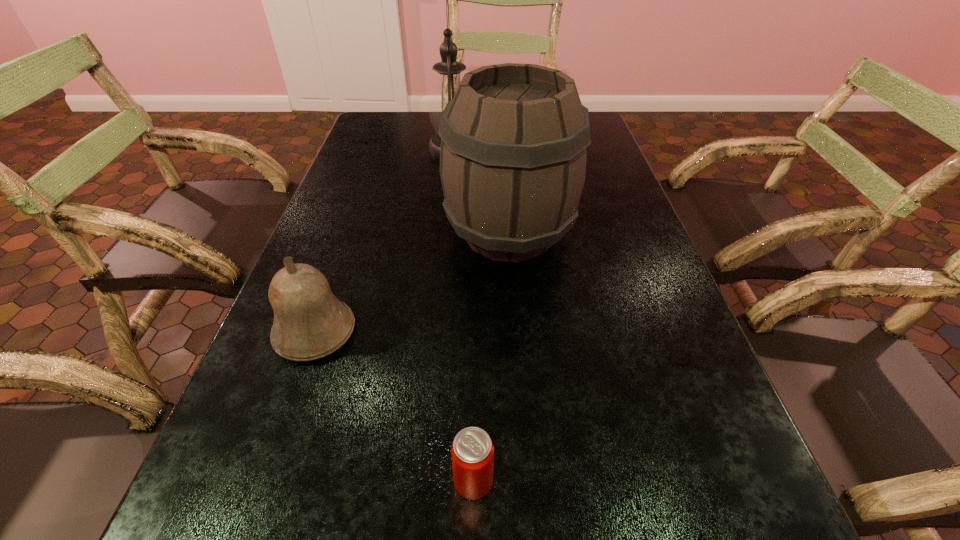
Identify the location of oil lamp. (449, 70).

Where is `the second tallest object`? The image size is (960, 540). the second tallest object is located at coordinates (513, 154).

At what (x,y) coordinates should I click in order to perform the action: click on wine bucket. Please return your answer as a coordinate pair (x, y). Looking at the image, I should click on (513, 154).

The height and width of the screenshot is (540, 960). Find the location of `the second nearest object`. the second nearest object is located at coordinates (x=309, y=323).

You are a GUI agent. You are given a task and a screenshot of the screen. Output one action in this format:
    pyautogui.click(x=<x>, y=<y>)
    Task: Click on the leftmost object
    The width and height of the screenshot is (960, 540).
    Given the screenshot: What is the action you would take?
    pyautogui.click(x=309, y=323)

Where is `the shortest object`? Image resolution: width=960 pixels, height=540 pixels. the shortest object is located at coordinates (472, 451).

You are a GUI agent. You are given a task and a screenshot of the screen. Output one action in this format:
    pyautogui.click(x=<x>, y=<y>)
    Task: Click on the nearest object
    This screenshot has width=960, height=540.
    Given the screenshot: What is the action you would take?
    pyautogui.click(x=472, y=451)

The width and height of the screenshot is (960, 540). In order to click on vacant area situated on the right of the oil lamp in this screenshot , I will do `click(582, 148)`.

Where is `free space located on the back of the second tallest object`? The width and height of the screenshot is (960, 540). free space located on the back of the second tallest object is located at coordinates (501, 133).

Locate an element on the screen. The height and width of the screenshot is (540, 960). free space located on the right of the bell is located at coordinates (423, 332).